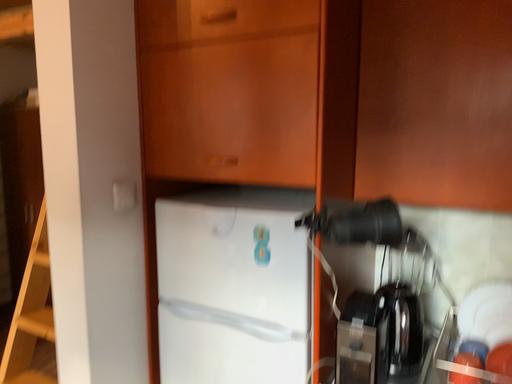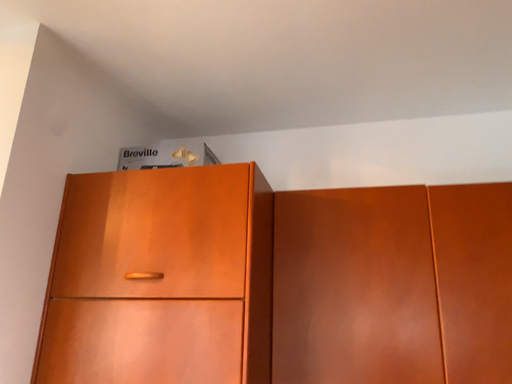
Question: How did the camera likely rotate when shooting the video?

Choices:
 (A) rotated right
 (B) rotated left

Answer: (A)